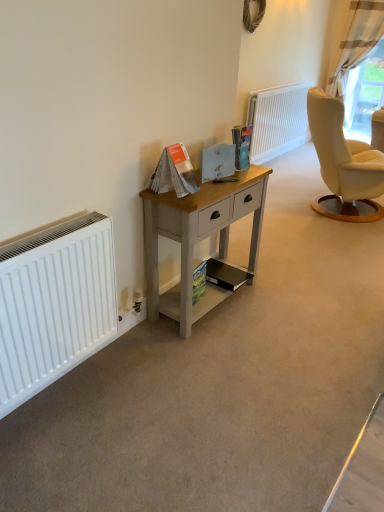
Question: In terms of height, does matte black magazine at lower center, which ranks as the 2th magazine in bottom-to-top order, look taller or shorter compared to matte blue card at center, which is counted as the second magazine, starting from the top?

Choices:
 (A) short
 (B) tall

Answer: (A)

Question: Is matte black magazine at lower center, which is the 4th magazine from top to bottom, to the left or to the right of matte blue card at center, which is counted as the second magazine, starting from the top, in the image?

Choices:
 (A) right
 (B) left

Answer: (A)

Question: Which object is the closest to the light gray wood desk at center?

Choices:
 (A) matte paper magazine at center, marked as the 3th magazine in a bottom-to-top arrangement
 (B) white matte radiator at upper center, which ranks as the second radiator in bottom-to-top order
 (C) matte blue card at center, which is counted as the 4th magazine, starting from the bottom
 (D) transparent glass window at upper right
 (E) matte paper magazine at center, the 5th magazine when ordered from bottom to top

Answer: (A)

Question: Which object is the farthest from the green matte magazine at lower center, the 1th magazine positioned from the bottom?

Choices:
 (A) light gray wood desk at center
 (B) matte paper magazine at center, marked as the 3th magazine in a bottom-to-top arrangement
 (C) white matte radiator at lower left, which is counted as the 2th radiator, starting from the right
 (D) matte paper magazine at center, the 5th magazine when ordered from bottom to top
 (E) white textured curtain at upper right

Answer: (E)